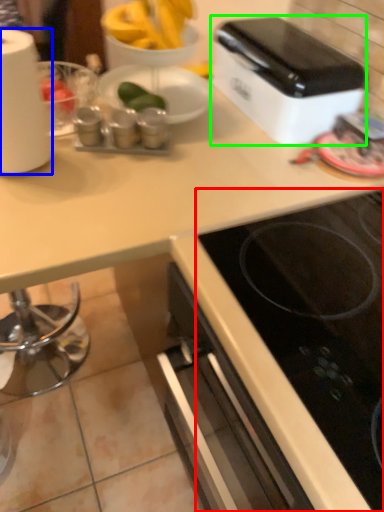
Question: Which object is the farthest from gas stove (highlighted by a red box)? Choose among these: paper towel (highlighted by a blue box) or toaster (highlighted by a green box).

Choices:
 (A) paper towel
 (B) toaster

Answer: (A)